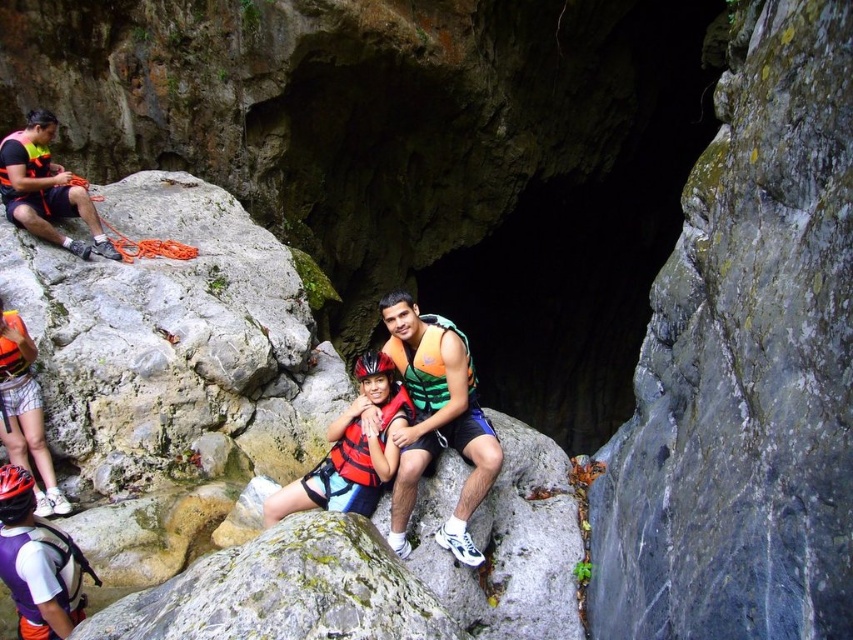
You are a photographer preparing to take a picture of the orange life vest at center and the matte black rope at left. Which object should you focus on first if you want to capture both clearly in your shot?

The orange life vest at center is bigger than the matte black rope at left, so you should focus on the orange life vest at center first to ensure it is in sharp focus before adjusting for the smaller matte black rope at left.

You are a hiker planning to cross a narrow rocky path. You see an orange life vest at center and a matte black rope at left. Which item is located closer to the ground?

The orange life vest at center is positioned under the matte black rope at left, meaning it is closer to the ground.